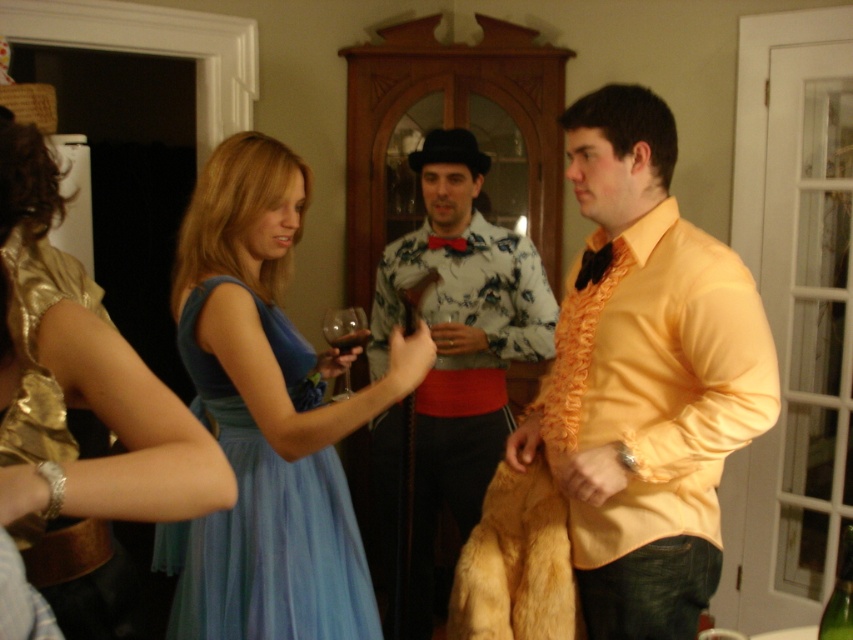
You are at the party and want to move from the location of point (x=350, y=336) to point (x=250, y=420). Is the path between them clear of obstacles?

Yes, the path between point (x=250, y=420) and point (x=350, y=336) is clear since point (x=250, y=420) is in front of point (x=350, y=336), indicating no obstruction between them.

You are at a party and want to talk to both the floral shirt at center and the light blue tulle dress at center. Which one should you approach first to be closer to you?

You should approach the floral shirt at center first because it is closer to you than the light blue tulle dress at center.

You are taking a photo of the scene and want to focus on both point (65, 563) and point (440, 307). Which point should you adjust your focus to first to ensure both are in focus?

Point (65, 563) is closer to the camera than point (440, 307), so you should focus on point (65, 563) first to ensure both are in focus.